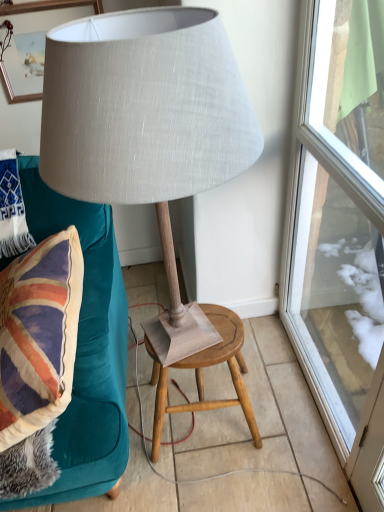
Locate an element on the screen. Image resolution: width=384 pixels, height=512 pixels. free space above wooden stool at center (from a real-world perspective) is located at coordinates (197, 335).